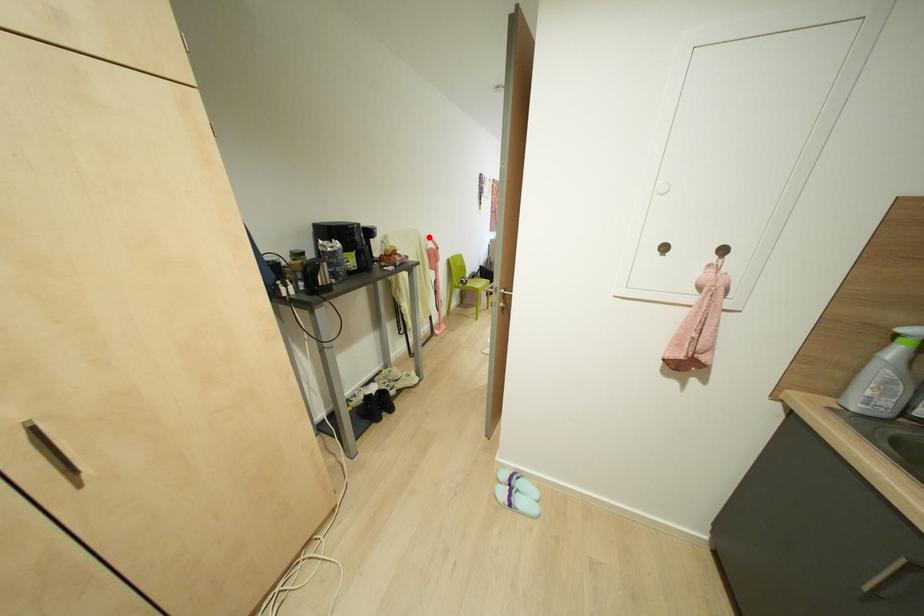
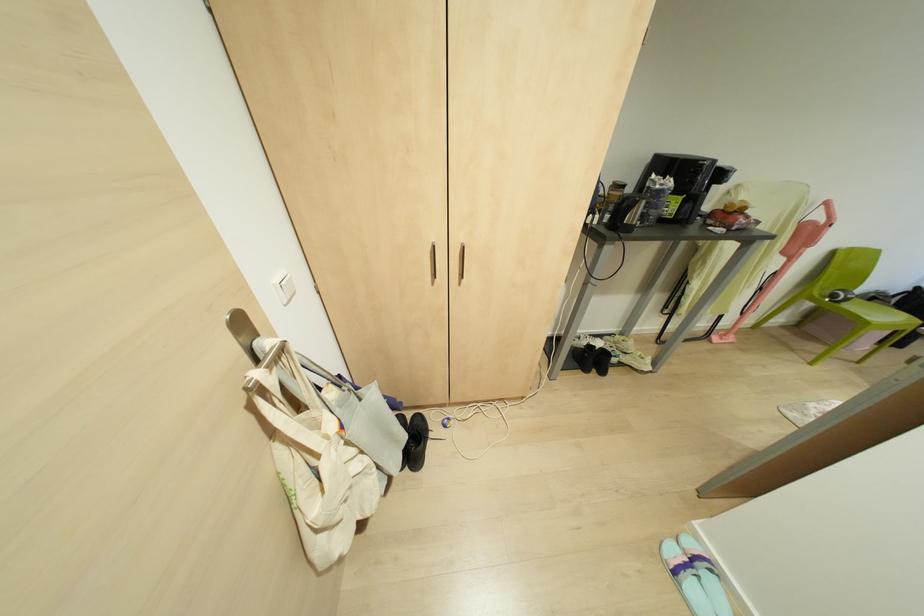
Question: I am providing you with two images of the same scene from different viewpoints. Image1 has a red point marked. In image2, the corresponding 3D location appears at what relative position? Reply with the corresponding letter.

Choices:
 (A) Closer
 (B) Farther

Answer: (B)